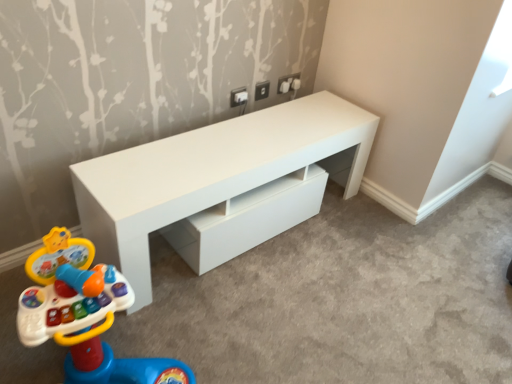
The image size is (512, 384). I want to click on free space between white glossy table at center and plastic multicolored xylophone at lower left, so click(x=263, y=287).